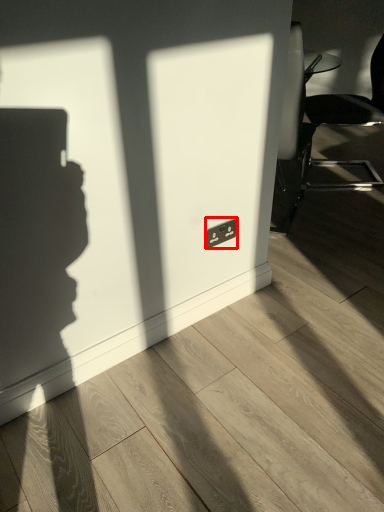
Question: From the image's perspective, what is the correct spatial positioning of electric outlet (annotated by the red box) in reference to chair?

Choices:
 (A) below
 (B) above

Answer: (A)